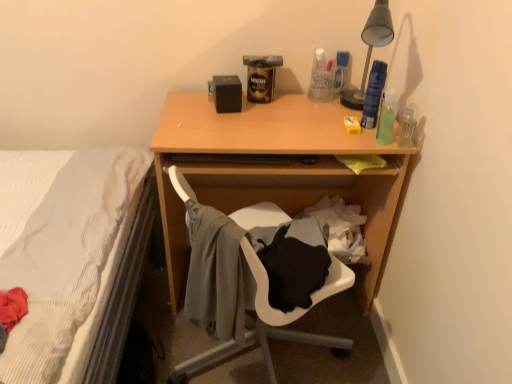
Locate an element on the screen. Image resolution: width=512 pixels, height=384 pixels. unoccupied region to the right of black matte speaker at upper center is located at coordinates (279, 109).